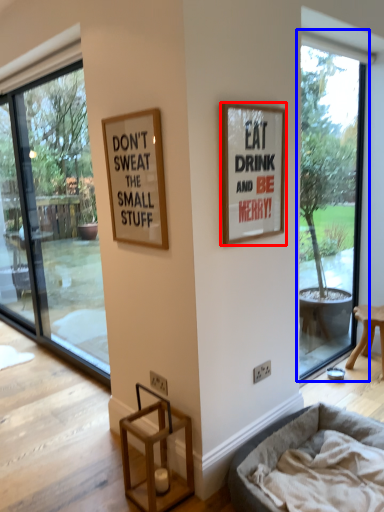
Question: Which object appears closest to the camera in this image, picture frame (highlighted by a red box) or window (highlighted by a blue box)?

Choices:
 (A) picture frame
 (B) window

Answer: (A)